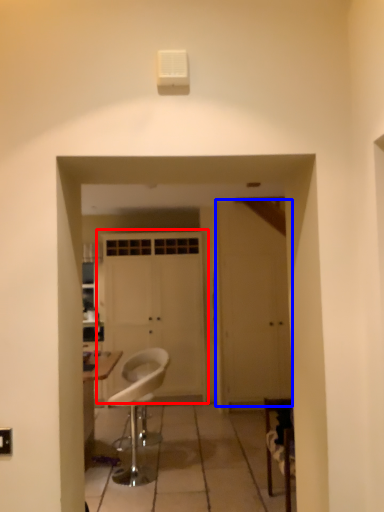
Question: Which point is closer to the camera, door (highlighted by a red box) or door (highlighted by a blue box)?

Choices:
 (A) door
 (B) door

Answer: (B)